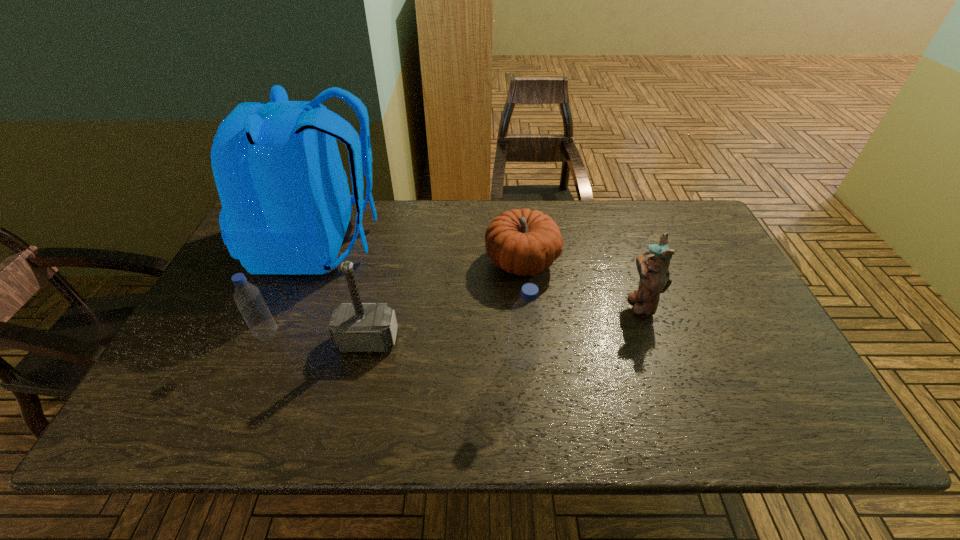
Image resolution: width=960 pixels, height=540 pixels. Find the location of `free space between the shorter bottle and the figurine`. free space between the shorter bottle and the figurine is located at coordinates (454, 319).

Find the location of a particular element. vacant area that lies between the farther bottle and the hammer is located at coordinates (318, 337).

What are the coordinates of `empty space between the rightmost object and the shortest object` in the screenshot? It's located at (581, 284).

Locate an element on the screen. empty space between the pumpkin and the backpack is located at coordinates (420, 253).

Identify the location of empty space that is in between the farther bottle and the tallest object. (294, 289).

Select which object appears as the second closest to the hammer. Please provide its 2D coordinates. Your answer should be formatted as a tuple, i.e. [(x, y)], where the tuple contains the x and y coordinates of a point satisfying the conditions above.

[(286, 205)]

Select which object is the fifth closest to the farther bottle. Please provide its 2D coordinates. Your answer should be formatted as a tuple, i.e. [(x, y)], where the tuple contains the x and y coordinates of a point satisfying the conditions above.

[(653, 267)]

At what (x,y) coordinates should I click in order to perform the action: click on free space that satisfies the following two spatial constraints: 1. on the back side of the farther bottle; 2. on the left side of the pumpkin. Please return your answer as a coordinate pair (x, y). This screenshot has width=960, height=540. Looking at the image, I should click on (299, 263).

The image size is (960, 540). What are the coordinates of `vacant region that satisfies the following two spatial constraints: 1. on the back of the tallest object; 2. on the back side of the pumpkin` in the screenshot? It's located at (312, 263).

Image resolution: width=960 pixels, height=540 pixels. I want to click on vacant area that satisfies the following two spatial constraints: 1. on the front side of the nearer bottle; 2. on the left side of the left bottle, so click(x=254, y=363).